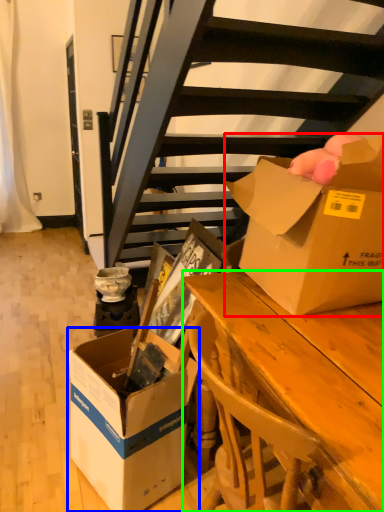
Question: Estimate the real-world distances between objects in this image. Which object is closer to box (highlighted by a red box), box (highlighted by a blue box) or desk (highlighted by a green box)?

Choices:
 (A) box
 (B) desk

Answer: (B)